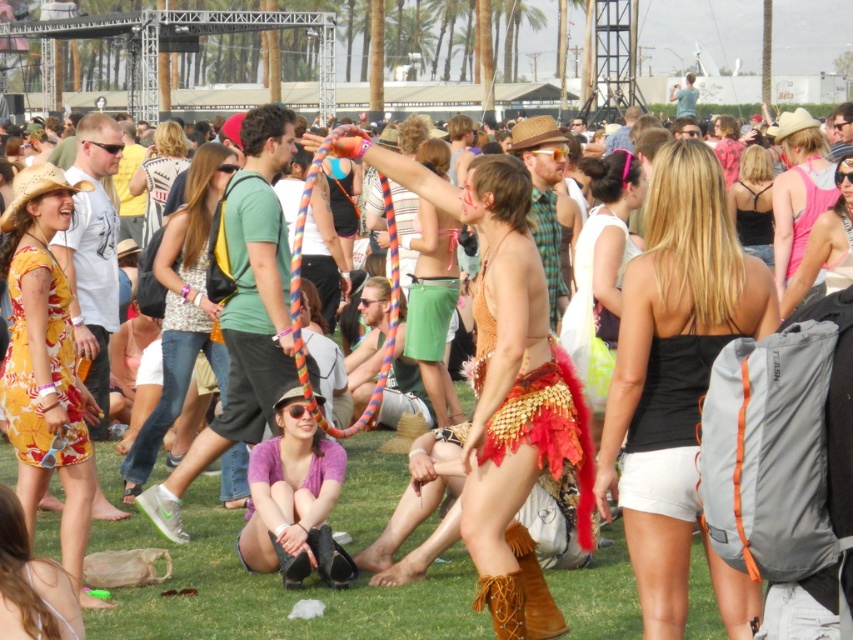
Question: Which object is positioned farthest from the green grass at center?

Choices:
 (A) yellow floral dress at center
 (B) matte pink bikini top at lower center
 (C) black satin tank top at center
 (D) pink tank top at upper right

Answer: (C)

Question: Is black matte tank top at center to the right of denim jeans at center from the viewer's perspective?

Choices:
 (A) yes
 (B) no

Answer: (A)

Question: Which of these objects is positioned closest to the denim jeans at center?

Choices:
 (A) black satin tank top at center
 (B) yellow floral dress at center
 (C) black matte tank top at center
 (D) matte yellow dress at center

Answer: (B)

Question: Which of these objects is positioned closest to the green grass at center?

Choices:
 (A) matte pink bikini top at lower center
 (B) black satin tank top at center

Answer: (A)

Question: Can you confirm if yellow floral dress at center is wider than matte pink bikini top at lower center?

Choices:
 (A) no
 (B) yes

Answer: (B)

Question: Is matte pink bikini top at lower center positioned at the back of black satin tank top at center?

Choices:
 (A) no
 (B) yes

Answer: (A)